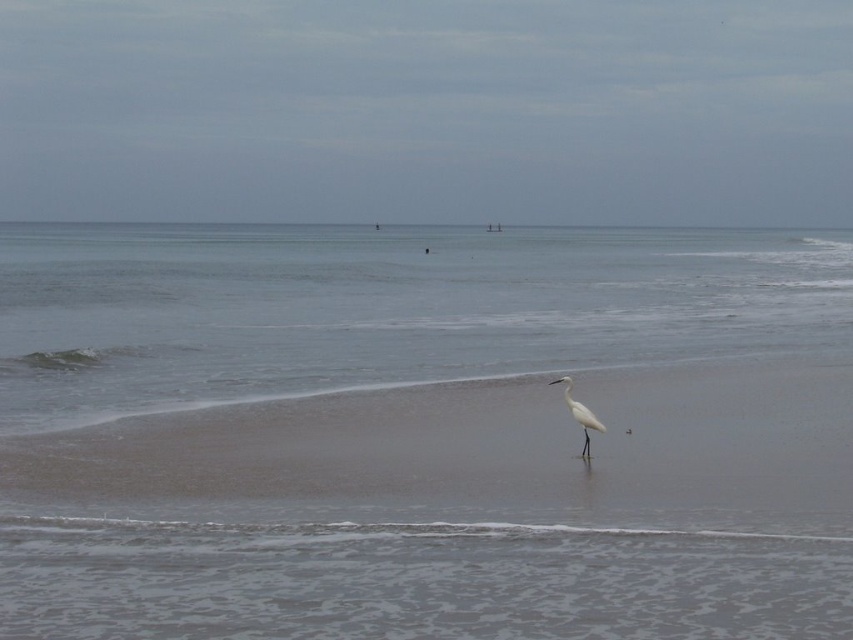
You are a photographer trying to capture the white matte bird at center and the smooth sand at center in a single shot. Based on the scene, which object occupies more horizontal space in the image?

The smooth sand at center might be wider than white matte bird at center according to the description.

You are standing on the beach and see the point at coordinates (x=422, y=433). Based on the scene description, what is the location of this point relative to the wet sand and the clear water?

The point at coordinates (x=422, y=433) is located on clear water at center, so it is on the clear water and not on the wet sand.